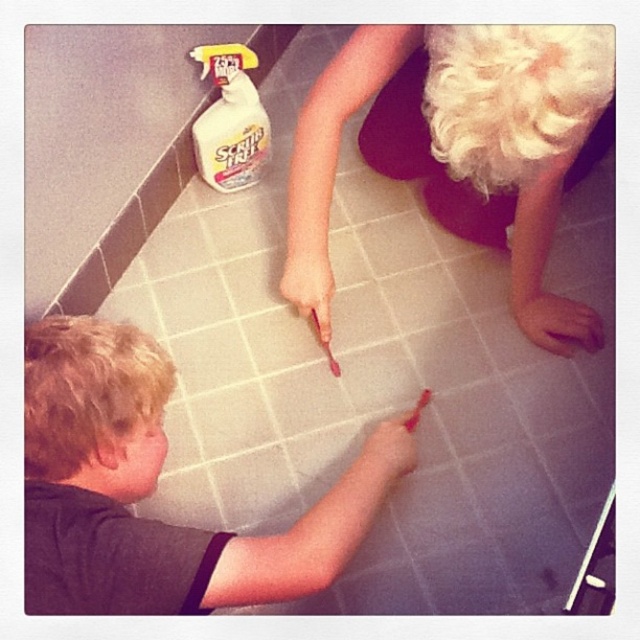
Question: Is smooth skin boy at lower left behind pink matte finger at center?

Choices:
 (A) yes
 (B) no

Answer: (B)

Question: Does pink matte finger at center have a greater width compared to smooth pink crayon at lower center?

Choices:
 (A) yes
 (B) no

Answer: (A)

Question: Which object is the farthest from the smooth pink crayon at lower center?

Choices:
 (A) pink matte hand at lower right
 (B) pink matte crayon at center
 (C) pink matte finger at center

Answer: (A)

Question: Which of these objects is positioned farthest from the pink matte finger at center?

Choices:
 (A) smooth skin boy at lower left
 (B) pink matte crayon at center

Answer: (A)

Question: Which point is closer to the camera?

Choices:
 (A) smooth skin boy at lower left
 (B) smooth pink crayon at lower center

Answer: (A)

Question: Can you confirm if blonde hair wig at upper right is bigger than pink matte hand at lower right?

Choices:
 (A) no
 (B) yes

Answer: (B)